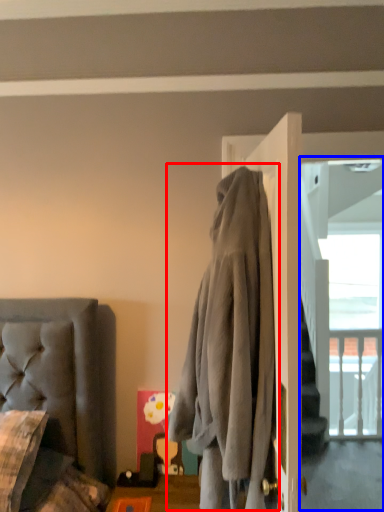
Question: Which object is further to the camera taking this photo, clothing (highlighted by a red box) or screen door (highlighted by a blue box)?

Choices:
 (A) clothing
 (B) screen door

Answer: (B)